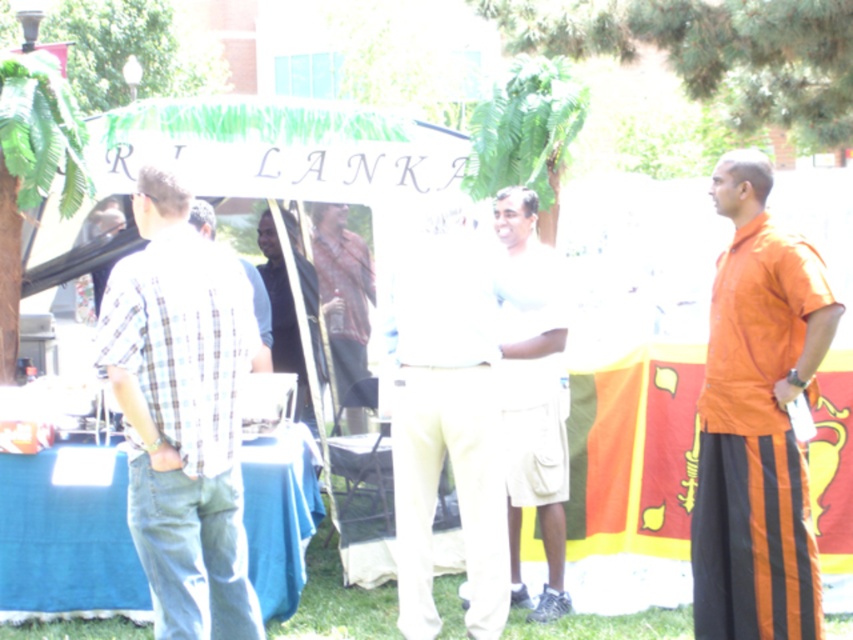
Does plaid shirt at left have a lesser height compared to blue fabric tablecloth at lower left?

Incorrect, plaid shirt at left's height does not fall short of blue fabric tablecloth at lower left's.

Is point (235, 604) farther from camera compared to point (38, 508)?

No, (235, 604) is closer to viewer.

Locate an element on the screen. This screenshot has width=853, height=640. plaid shirt at left is located at coordinates (183, 412).

Between point (497, 563) and point (206, 236), which one is positioned in front?

Point (497, 563) is more forward.

Describe the element at coordinates (445, 419) in the screenshot. I see `light beige cotton pants at center` at that location.

Where is `light beige cotton pants at center`? This screenshot has width=853, height=640. light beige cotton pants at center is located at coordinates (445, 419).

Does point (781, 296) lie behind point (202, 228)?

No, (781, 296) is closer to viewer.

Based on the photo, who is more forward, (782, 572) or (209, 234)?

Point (782, 572) is in front.

Who is more forward, (740, 579) or (190, 221)?

Point (740, 579)

This screenshot has height=640, width=853. I want to click on orange cotton kurta at right, so click(757, 420).